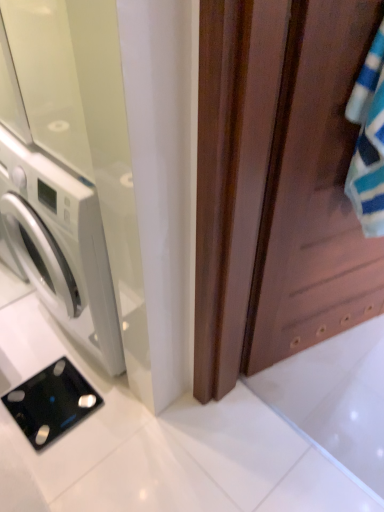
Question: Does white glossy door at left, arranged as the 1th screen door when viewed from the left, have a greater height compared to black glass scale at lower left?

Choices:
 (A) yes
 (B) no

Answer: (A)

Question: Are white glossy door at left, arranged as the 1th screen door when viewed from the left, and black glass scale at lower left far apart?

Choices:
 (A) yes
 (B) no

Answer: (B)

Question: Does white glossy door at left, arranged as the 1th screen door when viewed from the left, lie behind black glass scale at lower left?

Choices:
 (A) no
 (B) yes

Answer: (A)

Question: From a real-world perspective, is white glossy door at left, arranged as the 1th screen door when viewed from the left, under black glass scale at lower left?

Choices:
 (A) no
 (B) yes

Answer: (A)

Question: Is white glossy door at left, the 2th screen door in the right-to-left sequence, at the left side of black glass scale at lower left?

Choices:
 (A) yes
 (B) no

Answer: (B)

Question: Is point (302, 169) closer or farther from the camera than point (84, 102)?

Choices:
 (A) closer
 (B) farther

Answer: (B)

Question: In terms of height, does brown wooden screen door at right, placed as the 2th screen door when sorted from left to right, look taller or shorter compared to white glossy door at left, the 2th screen door in the right-to-left sequence?

Choices:
 (A) short
 (B) tall

Answer: (B)

Question: Visually, is brown wooden screen door at right, the first screen door in the right-to-left sequence, positioned to the left or to the right of white glossy door at left, arranged as the 1th screen door when viewed from the left?

Choices:
 (A) left
 (B) right

Answer: (B)

Question: Considering the positions of brown wooden screen door at right, placed as the 2th screen door when sorted from left to right, and white glossy door at left, the 2th screen door in the right-to-left sequence, in the image, is brown wooden screen door at right, placed as the 2th screen door when sorted from left to right, bigger or smaller than white glossy door at left, the 2th screen door in the right-to-left sequence,?

Choices:
 (A) small
 (B) big

Answer: (A)

Question: From the image's perspective, is black glass scale at lower left above or below brown wooden screen door at right, the first screen door in the right-to-left sequence?

Choices:
 (A) below
 (B) above

Answer: (A)

Question: Relative to brown wooden screen door at right, the first screen door in the right-to-left sequence, is black glass scale at lower left in front or behind?

Choices:
 (A) front
 (B) behind

Answer: (B)

Question: Based on their sizes in the image, would you say black glass scale at lower left is bigger or smaller than brown wooden screen door at right, placed as the 2th screen door when sorted from left to right?

Choices:
 (A) small
 (B) big

Answer: (A)

Question: In the image, is black glass scale at lower left on the left side or the right side of brown wooden screen door at right, placed as the 2th screen door when sorted from left to right?

Choices:
 (A) right
 (B) left

Answer: (B)

Question: Is white glossy door at left, the 2th screen door in the right-to-left sequence, taller or shorter than black glass scale at lower left?

Choices:
 (A) short
 (B) tall

Answer: (B)

Question: In the image, is white glossy door at left, arranged as the 1th screen door when viewed from the left, on the left side or the right side of black glass scale at lower left?

Choices:
 (A) left
 (B) right

Answer: (B)